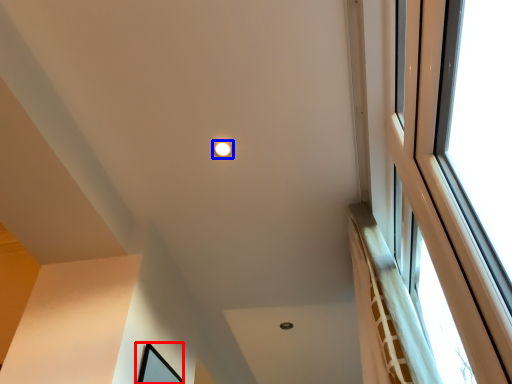
Question: Which point is closer to the camera, picture frame (highlighted by a red box) or lighting (highlighted by a blue box)?

Choices:
 (A) picture frame
 (B) lighting

Answer: (A)